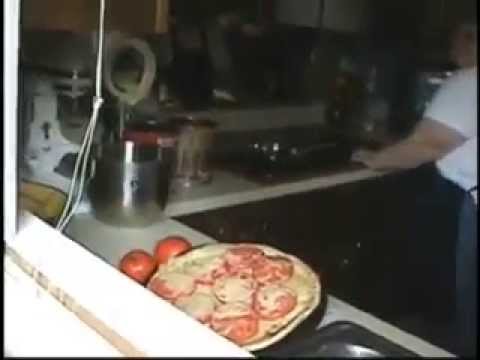
The width and height of the screenshot is (480, 360). Identify the location of mixer. (60, 141).